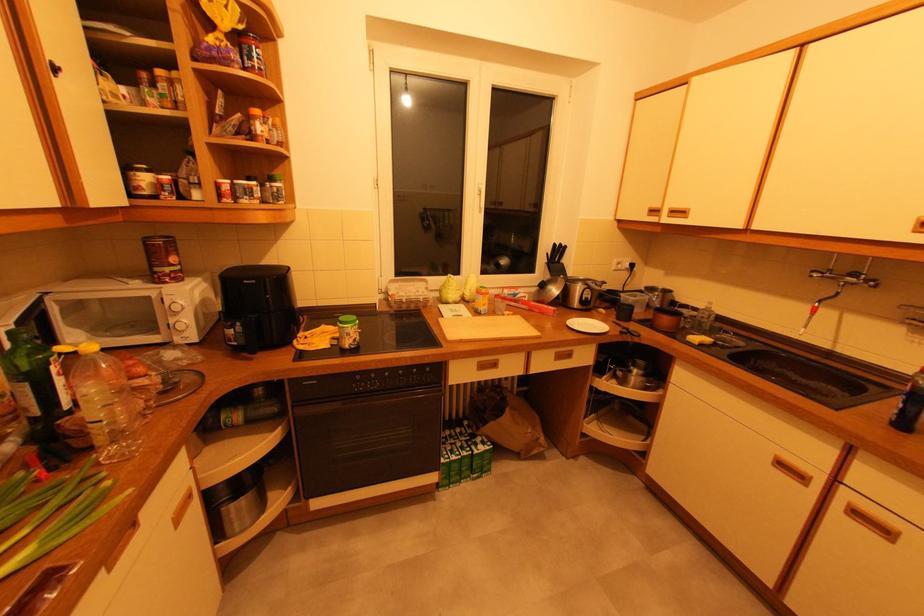
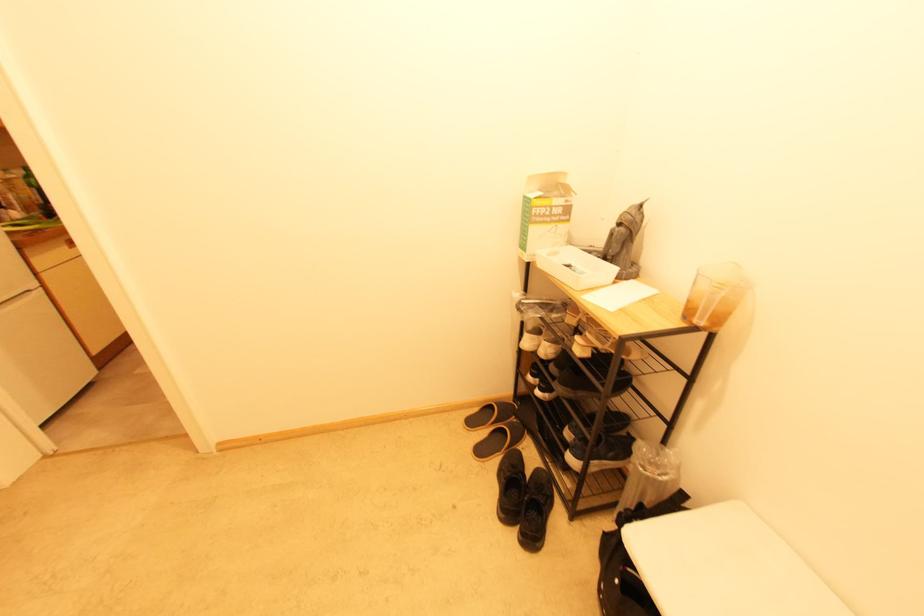
Question: I am providing you with two images of the same scene from different viewpoints. After the viewpoint changes to image2, which objects are now occluded?

Choices:
 (A) recessed cabinet handle
 (B) black shoe
 (C) black sneaker
 (D) metal bed handle

Answer: (A)